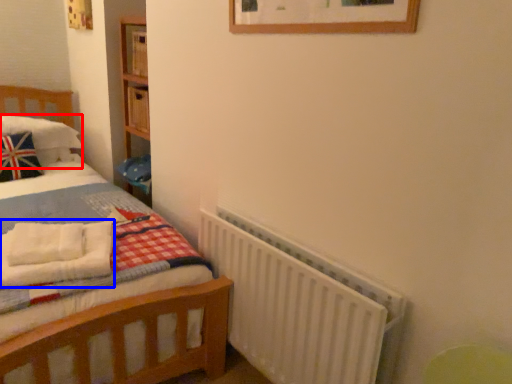
Question: Which of the following is the closest to the observer, pillow (highlighted by a red box) or blanket (highlighted by a blue box)?

Choices:
 (A) pillow
 (B) blanket

Answer: (B)